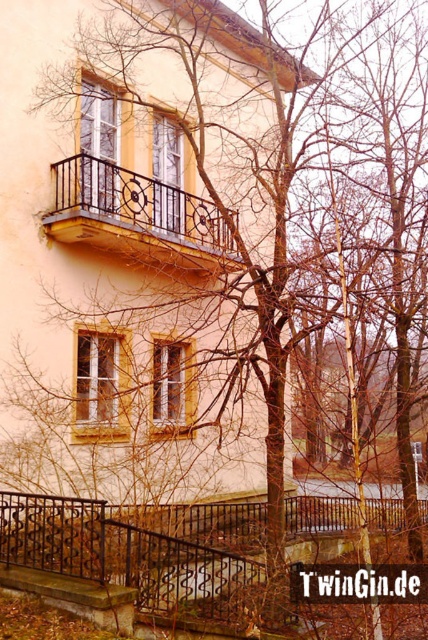
Question: Considering the real-world distances, which object is farthest from the matte glass window at center?

Choices:
 (A) matte glass window at upper center
 (B) black wrought iron railing at lower left
 (C) rustic wrought iron balcony at upper left

Answer: (A)

Question: Is black wrought iron railing at lower left to the left of matte glass window at center from the viewer's perspective?

Choices:
 (A) no
 (B) yes

Answer: (A)

Question: Considering the real-world distances, which object is closest to the black wrought iron railing at lower left?

Choices:
 (A) wooden textured window at center
 (B) rustic wrought iron balcony at upper left
 (C) matte black window at upper left
 (D) matte glass window at center

Answer: (D)

Question: Estimate the real-world distances between objects in this image. Which object is farther from the matte glass window at upper center?

Choices:
 (A) rustic wrought iron balcony at upper left
 (B) matte glass window at center
 (C) wooden textured window at center
 (D) matte black window at upper left

Answer: (B)

Question: Can you confirm if black wrought iron railing at lower left is wider than matte glass window at center?

Choices:
 (A) no
 (B) yes

Answer: (B)

Question: Is black wrought iron railing at lower left above matte glass window at center?

Choices:
 (A) yes
 (B) no

Answer: (B)